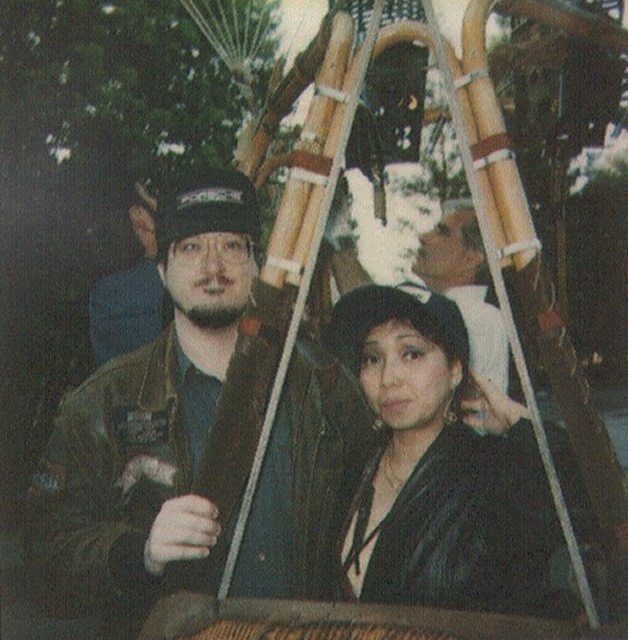
You are a photographer positioned to the side of the basket structure. You notice the black leather jacket at center and the matte black jacket at left. Which jacket is closer to the camera?

The black leather jacket at center is closer to the camera because it is positioned below the matte black jacket at left, meaning it is in a lower, more forward position relative to the camera.

You are standing in an amusement park and see the matte black cap at upper center in the distance. If you want to take a photo of it, will you need a zoom lens to capture it clearly?

The matte black cap at upper center is 8.30 meters away from viewer. Since it is relatively far away, using a zoom lens would help capture it clearly.